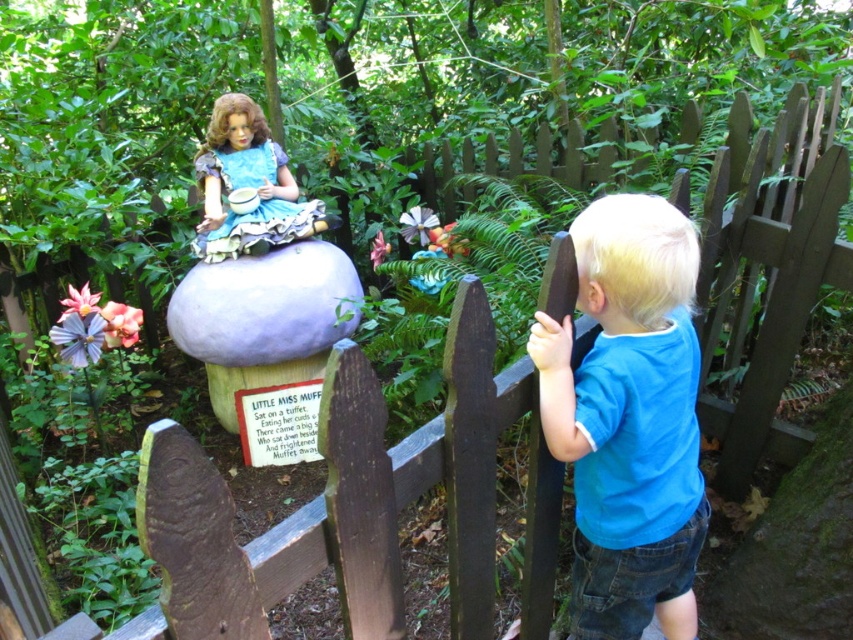
You are a tailor who needs to determine which item requires more fabric to repair. You see the blue cotton shirt at right and the matte blue fabric doll at upper center in the garden. Which item needs more fabric?

The blue cotton shirt at right requires more fabric to repair since it is bigger than the matte blue fabric doll at upper center.